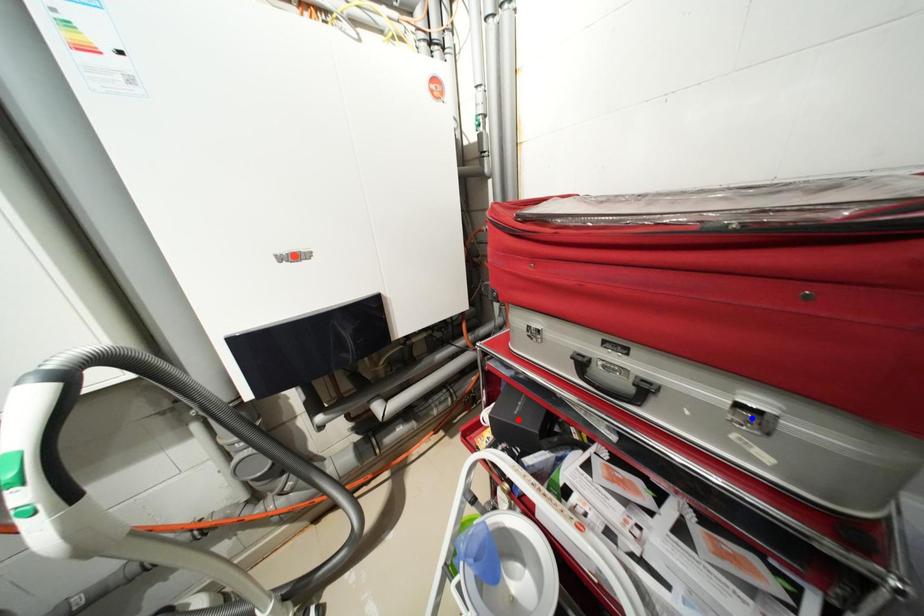
Question: Which of the two points in the image is closer to the camera?

Choices:
 (A) Blue point is closer.
 (B) Red point is closer.

Answer: (A)